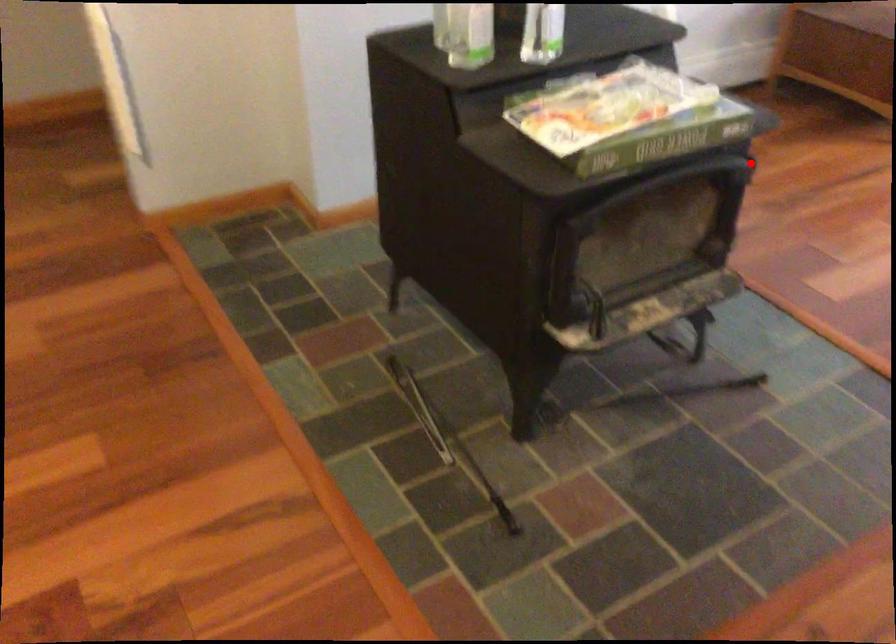
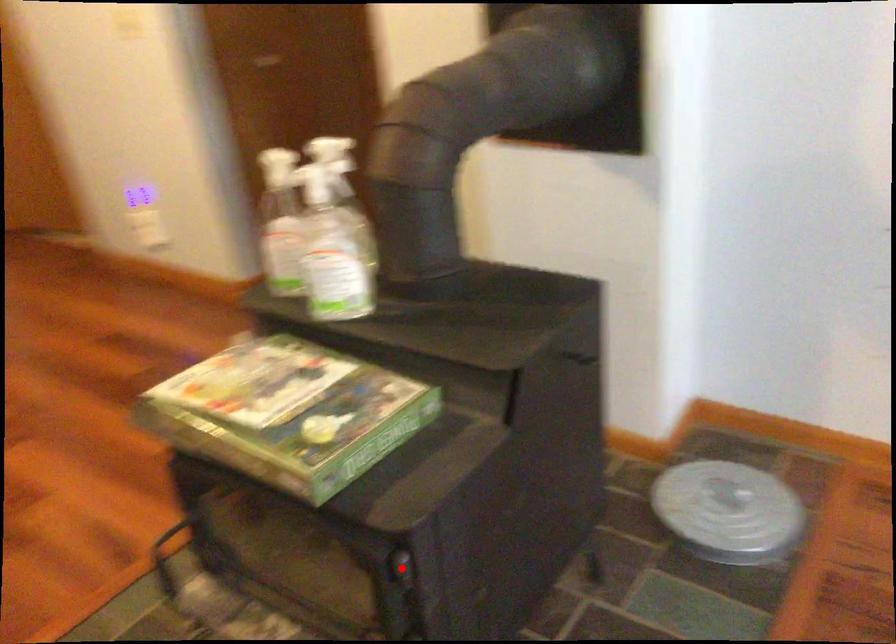
Consider the image. I am providing you with two images of the same scene from different viewpoints. A red point is marked on the first image and another point is marked on the second image. Is the marked point in image1 the same physical position as the marked point in image2?

Yes